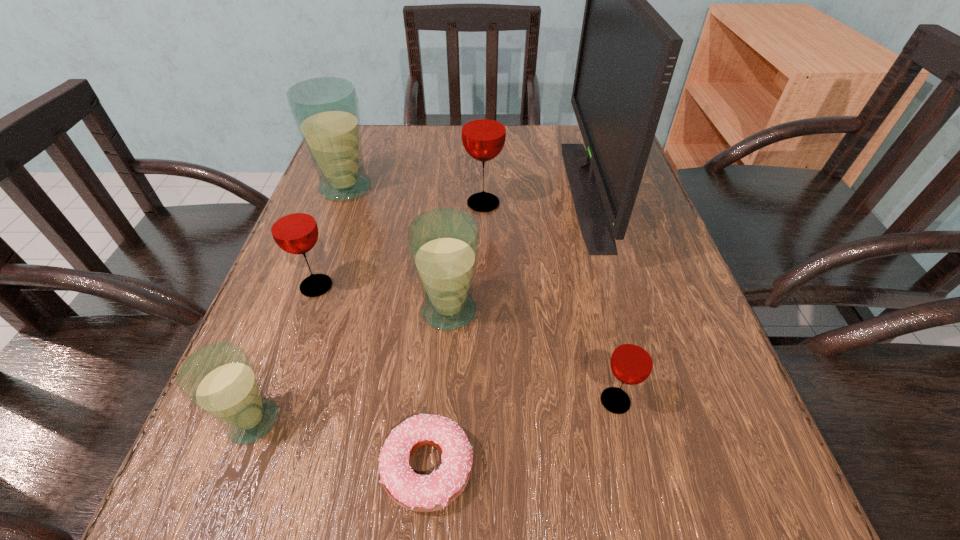
The image size is (960, 540). What are the coordinates of `the nearest blue glass` in the screenshot? It's located at (219, 379).

The image size is (960, 540). I want to click on the shortest object, so click(422, 493).

Where is `pink doughnut`? The width and height of the screenshot is (960, 540). pink doughnut is located at coordinates (422, 493).

The height and width of the screenshot is (540, 960). Identify the location of free location located 0.310m on the front-facing side of the tallest object. (434, 191).

Where is `vacant space situated on the front-facing side of the tallest object`? The image size is (960, 540). vacant space situated on the front-facing side of the tallest object is located at coordinates (398, 191).

Where is `free space located on the front-facing side of the tallest object`? The image size is (960, 540). free space located on the front-facing side of the tallest object is located at coordinates (446, 191).

Identify the location of free region located on the front of the second red glass from left to right. (484, 289).

Find the location of a particular element. The height and width of the screenshot is (540, 960). free location located 0.190m on the front of the biggest blue glass is located at coordinates (317, 267).

You are a GUI agent. You are given a task and a screenshot of the screen. Output one action in this format:
    pyautogui.click(x=<x>, y=<y>)
    Task: Click on the vacant point located 0.350m on the front of the second biggest red glass
    
    Given the screenshot: What is the action you would take?
    pyautogui.click(x=233, y=524)

The image size is (960, 540). Identify the location of vacant space located 0.190m on the back of the second nearest blue glass. (455, 221).